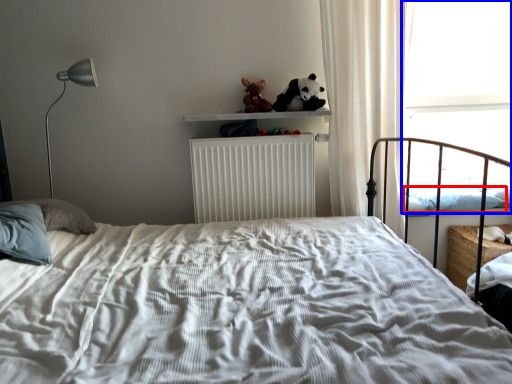
Question: Which of the following is the farthest to the observer, pillow (highlighted by a red box) or window screen (highlighted by a blue box)?

Choices:
 (A) pillow
 (B) window screen

Answer: (B)